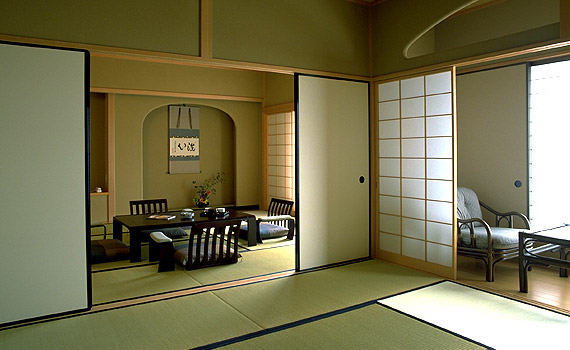
This screenshot has width=570, height=350. What are the coordinates of `table` in the screenshot? It's located at (563, 233).